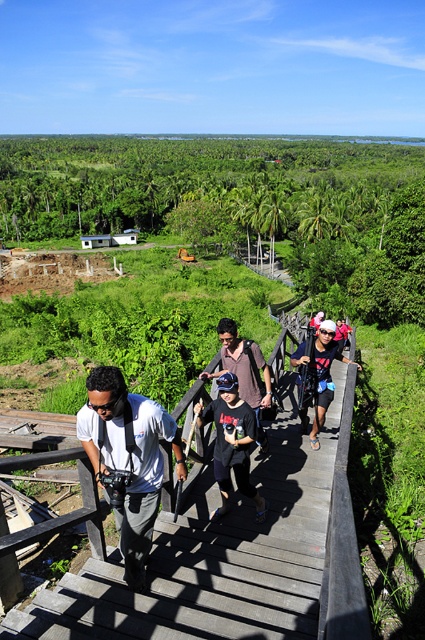
You are a hiker trying to cross the wooden bridge at center while carrying a matte black backpack at center. Which item should you place first on the bridge to ensure stability?

The wooden bridge at center is positioned on the left side of the matte black backpack at center. To ensure stability, you should place the wooden bridge at center first as it is already positioned to the left of the matte black backpack at center, allowing you to step onto the bridge before placing the backpack.

You are a hiker carrying a matte black backpack at center and need to cross the wooden bridge at center. Can your backpack fit through the bridge without any issues?

The wooden bridge at center is wider than the matte black backpack at center, so the backpack can fit through the bridge without any issues.

You are standing at the base of the wooden staircase in the image and want to reach the small white building in the midground. There are two points marked on the path ahead of you. Which point, point (265, 394) or point (340, 323), is closer to you as you start your climb?

Point (265, 394) is closer to you than point (340, 323) because it is nearer to the camera position.